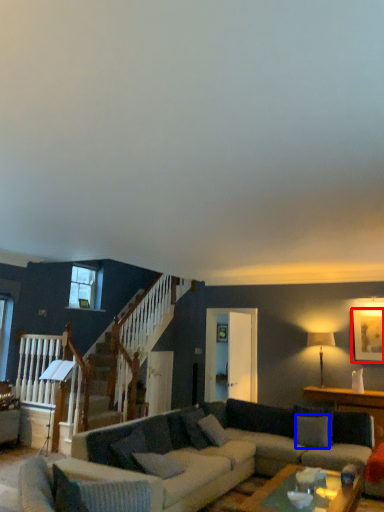
Question: Which object is closer to the camera taking this photo, picture frame (highlighted by a red box) or pillow (highlighted by a blue box)?

Choices:
 (A) picture frame
 (B) pillow

Answer: (B)